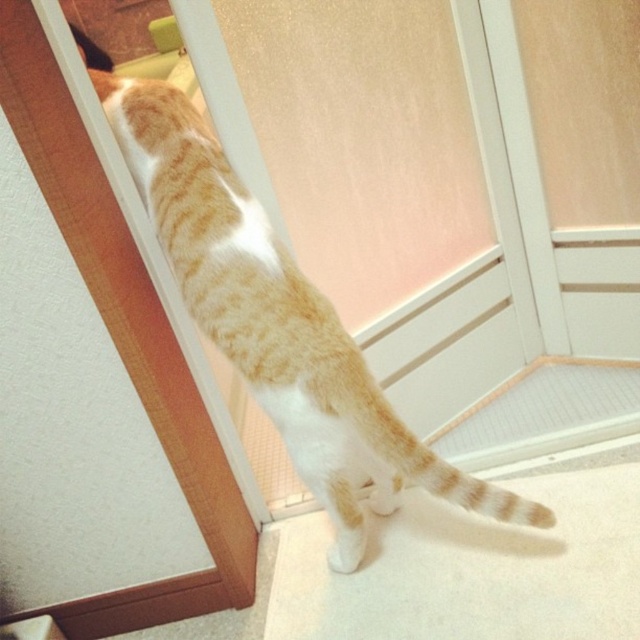
Is the position of orange tabby cat at center more distant than that of matte wood screen door at upper left?

Yes, it is behind matte wood screen door at upper left.

Consider the image. Does orange tabby cat at center have a greater height compared to matte wood screen door at upper left?

No, orange tabby cat at center is not taller than matte wood screen door at upper left.

Who is more distant from viewer, (225, 264) or (45, 113)?

The point (225, 264) is more distant.

What are the coordinates of `orange tabby cat at center` in the screenshot? It's located at (x=278, y=323).